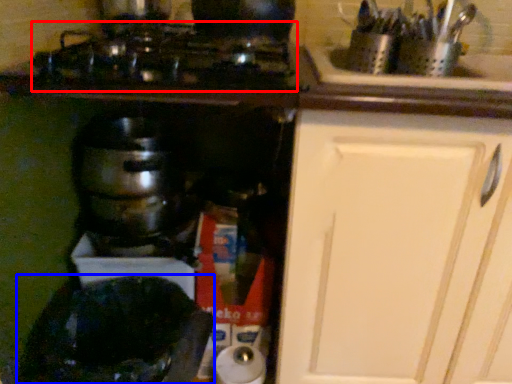
Question: Which point is closer to the camera, gas stove (highlighted by a red box) or appliance (highlighted by a blue box)?

Choices:
 (A) gas stove
 (B) appliance

Answer: (A)